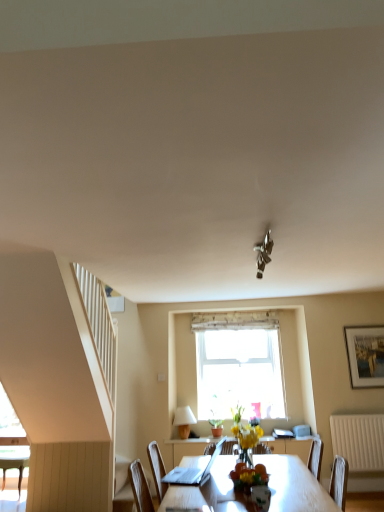
Question: Does metallic chrome light fixture at center touch white matte lampshade at lower center?

Choices:
 (A) yes
 (B) no

Answer: (B)

Question: Is metallic chrome light fixture at center at the left side of white matte lampshade at lower center?

Choices:
 (A) yes
 (B) no

Answer: (B)

Question: From a real-world perspective, is metallic chrome light fixture at center below white matte lampshade at lower center?

Choices:
 (A) yes
 (B) no

Answer: (B)

Question: Is metallic chrome light fixture at center further to camera compared to white matte lampshade at lower center?

Choices:
 (A) yes
 (B) no

Answer: (B)

Question: Is metallic chrome light fixture at center wider than white matte lampshade at lower center?

Choices:
 (A) no
 (B) yes

Answer: (A)

Question: Does metallic chrome light fixture at center have a smaller size compared to white matte lampshade at lower center?

Choices:
 (A) yes
 (B) no

Answer: (A)

Question: Is metallic chrome light fixture at center outside of silver metallic picture frame at upper right?

Choices:
 (A) yes
 (B) no

Answer: (A)

Question: Can you confirm if metallic chrome light fixture at center is smaller than silver metallic picture frame at upper right?

Choices:
 (A) no
 (B) yes

Answer: (B)

Question: Does metallic chrome light fixture at center have a larger size compared to silver metallic picture frame at upper right?

Choices:
 (A) no
 (B) yes

Answer: (A)

Question: Is silver metallic picture frame at upper right located within metallic chrome light fixture at center?

Choices:
 (A) no
 (B) yes

Answer: (A)

Question: Is metallic chrome light fixture at center thinner than silver metallic picture frame at upper right?

Choices:
 (A) yes
 (B) no

Answer: (B)

Question: Is metallic chrome light fixture at center directly adjacent to silver metallic picture frame at upper right?

Choices:
 (A) no
 (B) yes

Answer: (A)

Question: Considering the relative sizes of white matte lampshade at lower center and silver metallic picture frame at upper right in the image provided, is white matte lampshade at lower center shorter than silver metallic picture frame at upper right?

Choices:
 (A) yes
 (B) no

Answer: (A)